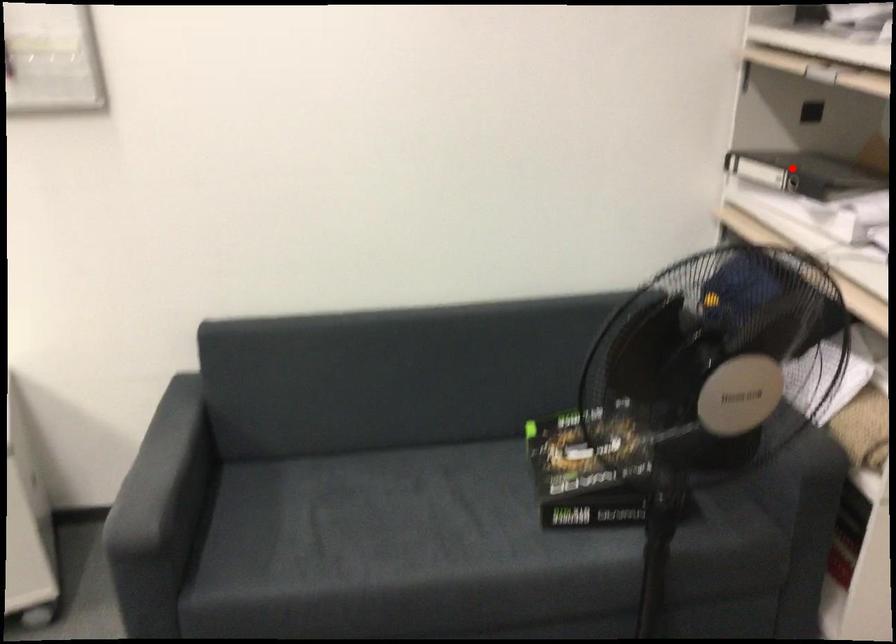
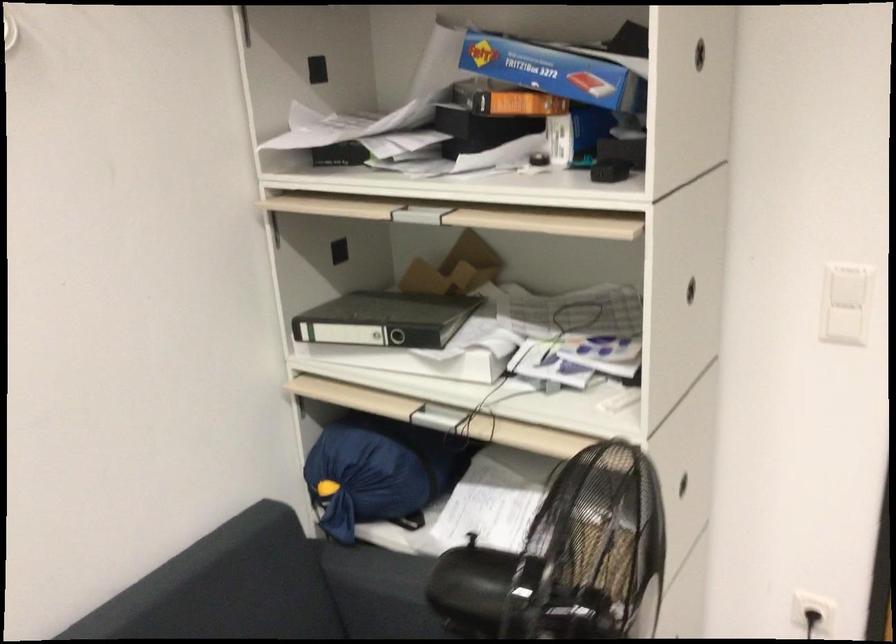
Question: I am providing you with two images of the same scene from different viewpoints. In image1, a red point is highlighted. Considering the same 3D point in image2, which of the following is correct?

Choices:
 (A) It is closer
 (B) It is farther

Answer: (A)